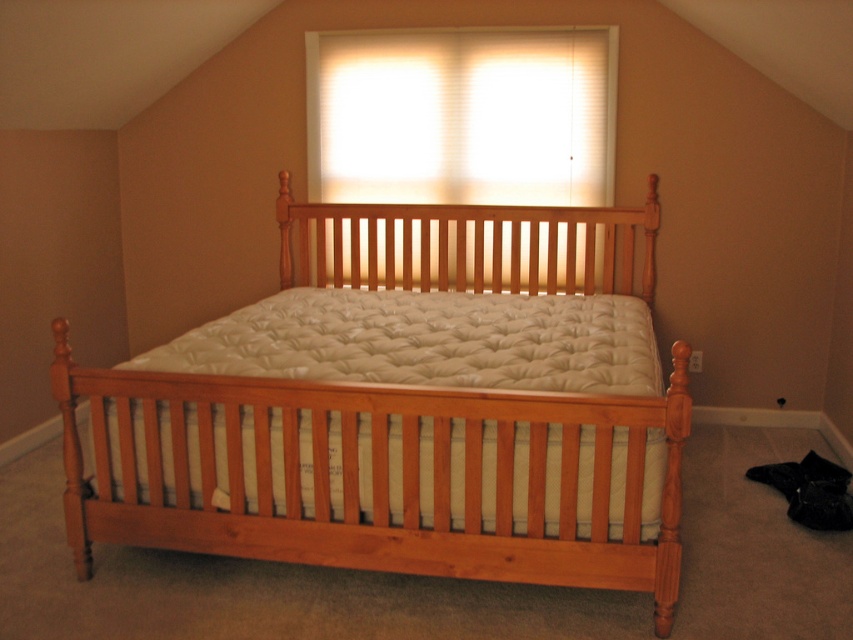
You are a painter who needs to hang a picture frame between the white quilted mattress at center and the white blinds at upper center. Which object should you place the frame closer to if you want it to be above the mattress but below the blinds?

You should place the frame closer to the white quilted mattress at center since it is located below the white blinds at upper center, allowing the frame to be positioned between them.

You are a painter who needs to hang a large painting on the wall behind the natural wood bed at center. Considering the height of the bed and the position of the white blinds at upper center, where should you place the painting so it doesn

The natural wood bed at center is much taller than the white blinds at upper center, so the painting should be placed above the bed to ensure it is visible and does not interfere with the blinds.

You are trying to decide whether to place a new rectangular painting between the natural wood bed at center and the white blinds at upper center. The painting is 1.2 meters wide. Can you fit it horizontally between them?

The natural wood bed at center might be wider than the white blinds at upper center, so the available space between them may not be wide enough to accommodate a 1.2 meter wide painting. You should measure the actual distance to confirm.